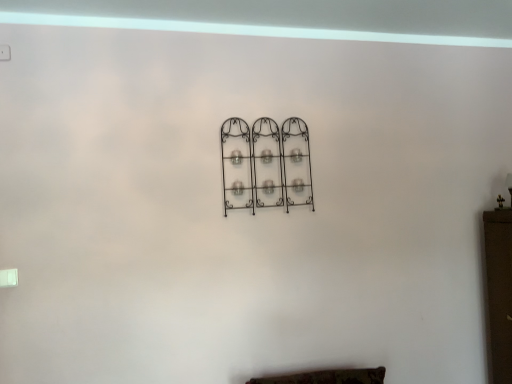
I want to click on metallic wire shelf at center, so click(266, 164).

This screenshot has width=512, height=384. What do you see at coordinates (266, 164) in the screenshot? I see `metallic wire shelf at center` at bounding box center [266, 164].

The height and width of the screenshot is (384, 512). I want to click on metallic wire shelf at center, so click(x=266, y=164).